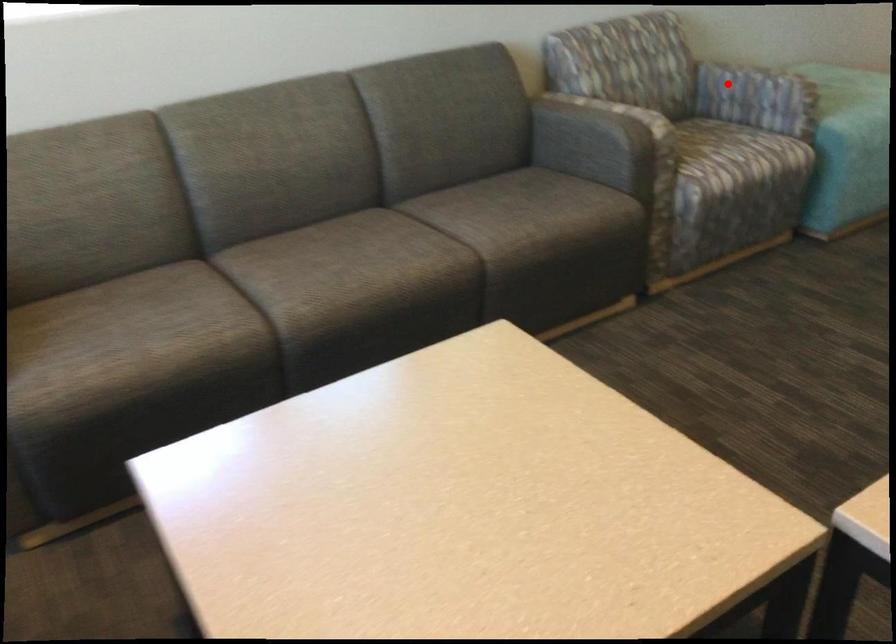
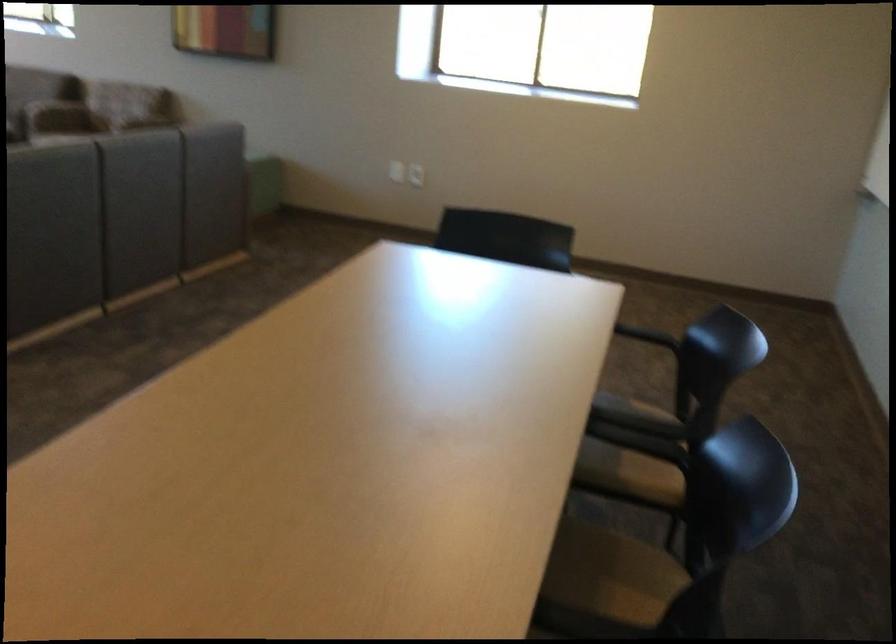
Question: I am providing you with two images of the same scene from different viewpoints. A red point is marked on the first image. Is the red point's position out of view in image 2?

Choices:
 (A) Yes
 (B) No

Answer: (A)